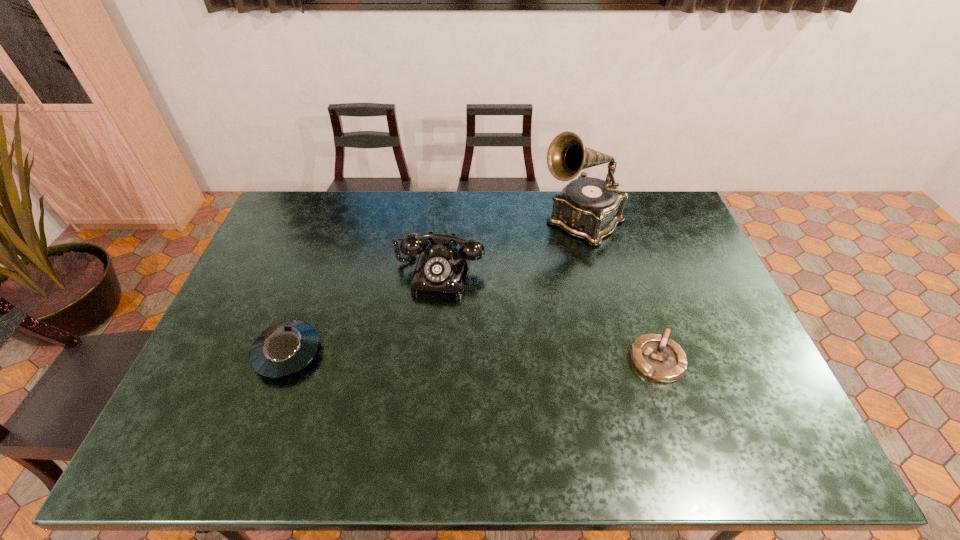
Find the location of a particular element. vacant area at the right edge of the desktop is located at coordinates (695, 343).

At what (x,y) coordinates should I click in order to perform the action: click on vacant region at the near right corner of the desktop. Please return your answer as a coordinate pair (x, y). Looking at the image, I should click on (732, 408).

Where is `unoccupied area between the telephone and the ashtray`? The height and width of the screenshot is (540, 960). unoccupied area between the telephone and the ashtray is located at coordinates (548, 315).

I want to click on vacant space that's between the tallest object and the telephone, so click(x=511, y=246).

Image resolution: width=960 pixels, height=540 pixels. In order to click on vacant space that is in between the second tallest object and the shortest object in this screenshot , I will do `click(548, 315)`.

Where is `vacant area between the saucer and the shortest object`? The width and height of the screenshot is (960, 540). vacant area between the saucer and the shortest object is located at coordinates (472, 356).

Where is `unoccupied area between the shortest object and the phonograph record`? This screenshot has height=540, width=960. unoccupied area between the shortest object and the phonograph record is located at coordinates (619, 290).

Find the location of `vacant region between the ashtray and the second shortest object`. vacant region between the ashtray and the second shortest object is located at coordinates (472, 356).

Find the location of `unoccupied position between the third object from right to left and the ashtray`. unoccupied position between the third object from right to left and the ashtray is located at coordinates (548, 315).

Find the location of a particular element. The height and width of the screenshot is (540, 960). free space between the shortest object and the saucer is located at coordinates (472, 356).